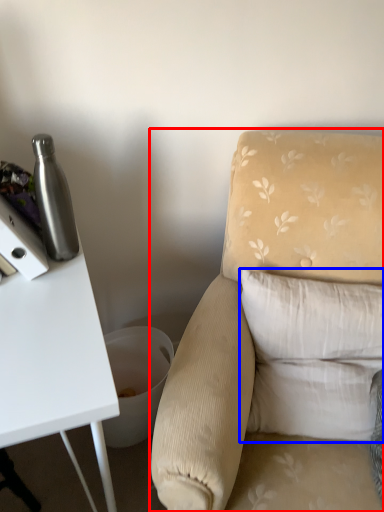
Question: Which of the following is the farthest to the observer, chair (highlighted by a red box) or pillow (highlighted by a blue box)?

Choices:
 (A) chair
 (B) pillow

Answer: (B)